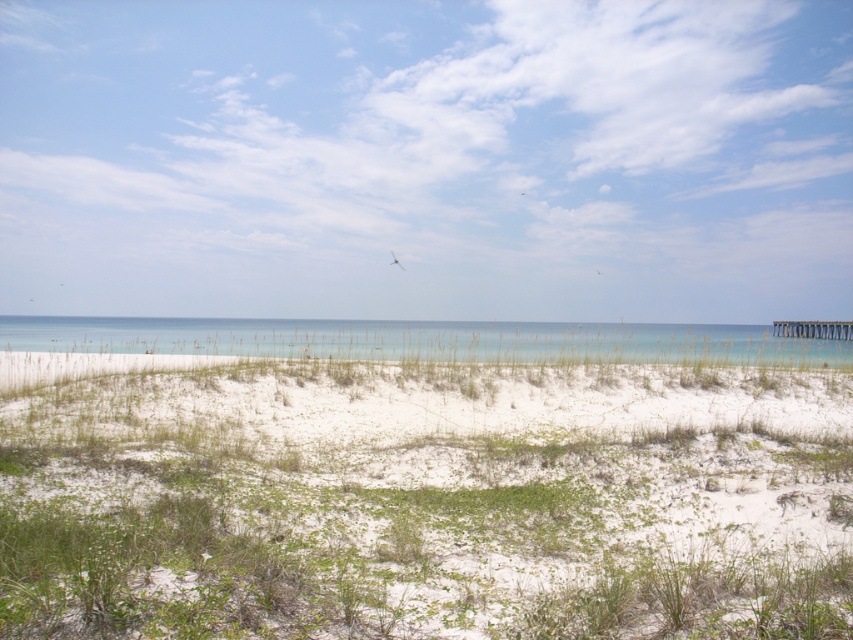
Who is taller, white sand dunes at center or clear blue water at center?

clear blue water at center is taller.

Between point (502, 628) and point (194, 321), which one is positioned in front?

Point (502, 628) is more forward.

In order to click on white sand dunes at center in this screenshot , I will do `click(428, 502)`.